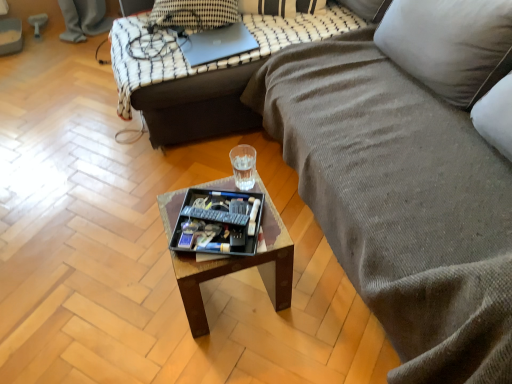
Question: Does sleek silver laptop at upper center lie behind black plastic tray at center?

Choices:
 (A) yes
 (B) no

Answer: (A)

Question: Considering the relative sizes of sleek silver laptop at upper center and black plastic tray at center in the image provided, is sleek silver laptop at upper center shorter than black plastic tray at center?

Choices:
 (A) no
 (B) yes

Answer: (A)

Question: From the image's perspective, does sleek silver laptop at upper center appear higher than black plastic tray at center?

Choices:
 (A) no
 (B) yes

Answer: (B)

Question: Considering the relative sizes of sleek silver laptop at upper center and black plastic tray at center in the image provided, is sleek silver laptop at upper center wider than black plastic tray at center?

Choices:
 (A) yes
 (B) no

Answer: (B)

Question: Does sleek silver laptop at upper center have a greater height compared to black plastic tray at center?

Choices:
 (A) yes
 (B) no

Answer: (A)

Question: Are sleek silver laptop at upper center and black plastic tray at center located far from each other?

Choices:
 (A) no
 (B) yes

Answer: (A)

Question: Is there a large distance between black plastic remote control at center and wooden tray at center?

Choices:
 (A) yes
 (B) no

Answer: (B)

Question: Could you tell me if black plastic remote control at center is facing wooden tray at center?

Choices:
 (A) no
 (B) yes

Answer: (A)

Question: Is black plastic remote control at center at the left side of wooden tray at center?

Choices:
 (A) no
 (B) yes

Answer: (B)

Question: From the image's perspective, would you say black plastic remote control at center is shown under wooden tray at center?

Choices:
 (A) yes
 (B) no

Answer: (B)

Question: From a real-world perspective, is black plastic remote control at center on top of wooden tray at center?

Choices:
 (A) no
 (B) yes

Answer: (B)

Question: Could wooden tray at center be considered to be inside black plastic remote control at center?

Choices:
 (A) no
 (B) yes

Answer: (A)

Question: From the image's perspective, does textured gray fabric couch at center, which ranks as the 1th studio couch in front-to-back order, appear lower than metallic gray swivel chair at upper left?

Choices:
 (A) yes
 (B) no

Answer: (A)